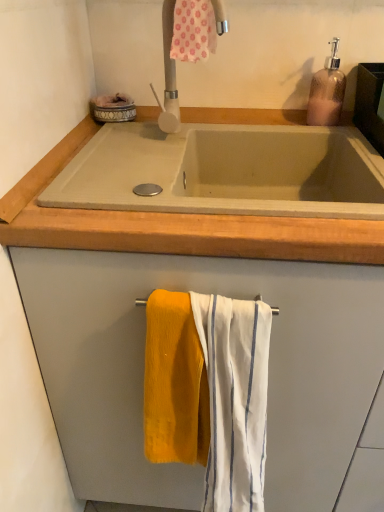
Locate an element on the screen. free space that is to the left of translucent brown soap dispenser at upper right is located at coordinates (261, 123).